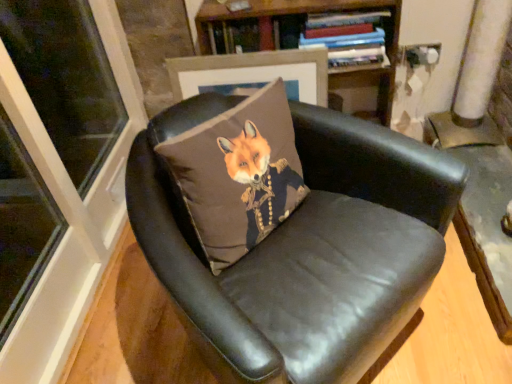
Question: Considering their positions, is brown fabric fox at center located in front of or behind black leather chair at center?

Choices:
 (A) behind
 (B) front

Answer: (A)

Question: Considering the positions of brown fabric fox at center and black leather chair at center in the image, is brown fabric fox at center wider or thinner than black leather chair at center?

Choices:
 (A) thin
 (B) wide

Answer: (A)

Question: Which is farther from the black leather chair at center?

Choices:
 (A) matte brown picture frame at upper center
 (B) brown fabric fox at center
 (C) wooden bookshelf at upper center
 (D) hardcover book at upper center

Answer: (C)

Question: Which object is positioned closest to the hardcover book at upper center?

Choices:
 (A) black leather chair at center
 (B) brown fabric fox at center
 (C) matte brown picture frame at upper center
 (D) wooden bookshelf at upper center

Answer: (D)